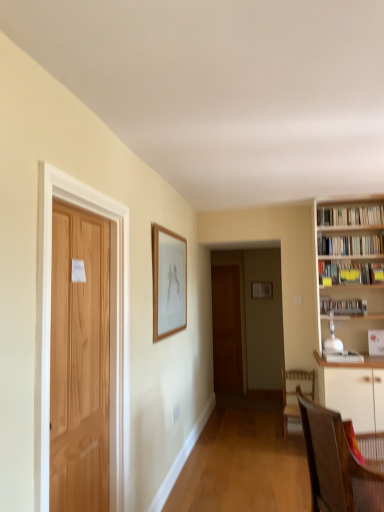
What is the approximate height of wooden picture frame at upper center, the 2th picture frame in the right-to-left sequence?

wooden picture frame at upper center, the 2th picture frame in the right-to-left sequence, is 32.49 inches in height.

You are a GUI agent. You are given a task and a screenshot of the screen. Output one action in this format:
    pyautogui.click(x=<x>, y=<y>)
    Task: Click on the white paper bookshelf at upper right, which is counted as the fourth book, starting from the bottom
    The width and height of the screenshot is (384, 512).
    Given the screenshot: What is the action you would take?
    pyautogui.click(x=350, y=216)

What do you see at coordinates (110, 331) in the screenshot?
I see `natural wood door at left, the first door from the left` at bounding box center [110, 331].

Where is `brown woven chair at lower right, which is the 2th chair in back-to-front order`? The image size is (384, 512). brown woven chair at lower right, which is the 2th chair in back-to-front order is located at coordinates (336, 464).

What are the coordinates of `wooden picture frame at upper center, the first picture frame when ordered from left to right` in the screenshot? It's located at click(x=168, y=282).

Considering the relative sizes of metallic silver bookshelf at right, which is the 1th book from bottom to top, and wooden picture frame at center, positioned as the 2th picture frame in left-to-right order, in the image provided, is metallic silver bookshelf at right, which is the 1th book from bottom to top, shorter than wooden picture frame at center, positioned as the 2th picture frame in left-to-right order,?

Indeed, metallic silver bookshelf at right, which is the 1th book from bottom to top, has a lesser height compared to wooden picture frame at center, positioned as the 2th picture frame in left-to-right order.

Looking at this image, which of these two, metallic silver bookshelf at right, which is the 1th book from bottom to top, or wooden picture frame at center, the first picture frame positioned from the back, is smaller?

Smaller between the two is wooden picture frame at center, the first picture frame positioned from the back.

Is metallic silver bookshelf at right, which is the 1th book from bottom to top, to the right of wooden picture frame at center, the first picture frame positioned from the back, from the viewer's perspective?

→ Yes, metallic silver bookshelf at right, which is the 1th book from bottom to top, is to the right of wooden picture frame at center, the first picture frame positioned from the back.

Is metallic silver bookshelf at right, which is the 1th book from bottom to top, outside of wooden picture frame at center, the first picture frame positioned from the back?

metallic silver bookshelf at right, which is the 1th book from bottom to top, lies outside wooden picture frame at center, the first picture frame positioned from the back,'s area.

Is brown woven chair at lower right, the first chair viewed from the front, inside or outside of natural wood door at left, which is counted as the second door, starting from the back?

brown woven chair at lower right, the first chair viewed from the front, is not enclosed by natural wood door at left, which is counted as the second door, starting from the back.

Between brown woven chair at lower right, which is the 2th chair in back-to-front order, and natural wood door at left, which is counted as the second door, starting from the back, which one appears on the left side from the viewer's perspective?

natural wood door at left, which is counted as the second door, starting from the back, is more to the left.

Which point is more distant from viewer, [335,500] or [120,461]?

The point [120,461] is farther from the camera.

From the picture: Which of these two, brown woven chair at lower right, the first chair viewed from the front, or natural wood door at left, the first door from the left, stands taller?

Standing taller between the two is natural wood door at left, the first door from the left.

How many degrees apart are the facing directions of yellow paper at upper right, the 2th book ordered from the bottom, and wooden picture frame at upper center, the first picture frame when ordered from left to right?

yellow paper at upper right, the 2th book ordered from the bottom, and wooden picture frame at upper center, the first picture frame when ordered from left to right, are facing 89.8 degrees away from each other.

Would you say yellow paper at upper right, the 2th book ordered from the bottom, is outside wooden picture frame at upper center, the 2th picture frame in the right-to-left sequence?

yellow paper at upper right, the 2th book ordered from the bottom, lies outside wooden picture frame at upper center, the 2th picture frame in the right-to-left sequence,'s area.

Is yellow paper at upper right, positioned as the third book in top-to-bottom order, oriented away from wooden picture frame at upper center, the 2th picture frame in the right-to-left sequence?

yellow paper at upper right, positioned as the third book in top-to-bottom order, is not turned away from wooden picture frame at upper center, the 2th picture frame in the right-to-left sequence.

Can you confirm if natural wood door at left, which ranks as the first door in front-to-back order, is bigger than brown wooden chair at lower right, the 1th chair when ordered from back to front?

Yes.

Considering the positions of objects natural wood door at left, the first door from the left, and brown wooden chair at lower right, which is counted as the second chair, starting from the front, in the image provided, who is more to the right, natural wood door at left, the first door from the left, or brown wooden chair at lower right, which is counted as the second chair, starting from the front,?

Positioned to the right is brown wooden chair at lower right, which is counted as the second chair, starting from the front.

Can you confirm if natural wood door at left, marked as the second door in a right-to-left arrangement, is shorter than brown wooden chair at lower right, the 1th chair when ordered from back to front?

No, natural wood door at left, marked as the second door in a right-to-left arrangement, is not shorter than brown wooden chair at lower right, the 1th chair when ordered from back to front.

From a real-world perspective, starting from the brown wooden chair at lower right, which is counted as the second chair, starting from the front, which door is the 2nd one vertically above it? Please provide its 2D coordinates.

[(110, 331)]

Considering the sizes of brown wooden chair at lower right, the 1th chair when ordered from back to front, and wooden picture frame at center, positioned as the 2th picture frame in left-to-right order, in the image, is brown wooden chair at lower right, the 1th chair when ordered from back to front, bigger or smaller than wooden picture frame at center, positioned as the 2th picture frame in left-to-right order,?

brown wooden chair at lower right, the 1th chair when ordered from back to front, is bigger than wooden picture frame at center, positioned as the 2th picture frame in left-to-right order.

Considering the positions of objects brown wooden chair at lower right, which is counted as the second chair, starting from the front, and wooden picture frame at center, which is the first picture frame in right-to-left order, in the image provided, who is more to the right, brown wooden chair at lower right, which is counted as the second chair, starting from the front, or wooden picture frame at center, which is the first picture frame in right-to-left order,?

wooden picture frame at center, which is the first picture frame in right-to-left order.

Is yellow paper at upper right, positioned as the third book in top-to-bottom order, closer to camera compared to wooden picture frame at center, which is the first picture frame in right-to-left order?

Yes, yellow paper at upper right, positioned as the third book in top-to-bottom order, is closer to the viewer.

Which is in front, point (340, 280) or point (272, 284)?

Point (340, 280)

Is yellow paper at upper right, the 2th book ordered from the bottom, with wooden picture frame at center, which is the first picture frame in right-to-left order?

yellow paper at upper right, the 2th book ordered from the bottom, is not next to wooden picture frame at center, which is the first picture frame in right-to-left order, and they're not touching.

Measure the distance between yellow paper at upper right, positioned as the third book in top-to-bottom order, and brown woven chair at lower right, which is the 2th chair in back-to-front order.

yellow paper at upper right, positioned as the third book in top-to-bottom order, and brown woven chair at lower right, which is the 2th chair in back-to-front order, are 6.92 feet apart from each other.

The image size is (384, 512). There is a yellow paper at upper right, the 2th book ordered from the bottom. Identify the location of the 1st chair below it (from the image's perspective). (336, 464).

Is yellow paper at upper right, positioned as the third book in top-to-bottom order, in front of or behind brown woven chair at lower right, the first chair viewed from the front, in the image?

Visually, yellow paper at upper right, positioned as the third book in top-to-bottom order, is located behind brown woven chair at lower right, the first chair viewed from the front.

Does yellow paper at upper right, the 2th book ordered from the bottom, contain brown woven chair at lower right, the first chair viewed from the front?

Definitely not — brown woven chair at lower right, the first chair viewed from the front, is not inside yellow paper at upper right, the 2th book ordered from the bottom.

Which book is the 2nd one when counting from the right side of the wooden picture frame at center, which is the first picture frame in right-to-left order? Please provide its 2D coordinates.

[(343, 306)]

From the image's perspective, count 1st chairs downward from the natural wood door at left, which is counted as the second door, starting from the back, and point to it. Please provide its 2D coordinates.

[(336, 464)]

Estimate the real-world distances between objects in this image. Which object is further from yellow paper at upper right, the 2th book ordered from the bottom, white paper bookshelf at upper right, which is the first book in top-to-bottom order, or wooden door at center, which appears as the first door when viewed from the right?

wooden door at center, which appears as the first door when viewed from the right, is further to yellow paper at upper right, the 2th book ordered from the bottom.

From the image, which object appears to be farther from white glossy bookshelf at right, placed as the 3th book when sorted from bottom to top, metallic silver bookshelf at right, which is counted as the 4th book, starting from the top, or wooden picture frame at upper center, the 1th picture frame when ordered from front to back?

wooden picture frame at upper center, the 1th picture frame when ordered from front to back.

Estimate the real-world distances between objects in this image. Which object is closer to wooden picture frame at upper center, which is the second picture frame from back to front, white paper bookshelf at upper right, which is counted as the fourth book, starting from the bottom, or brown wooden chair at lower right, the 1th chair when ordered from back to front?

brown wooden chair at lower right, the 1th chair when ordered from back to front, is positioned closer to the anchor wooden picture frame at upper center, which is the second picture frame from back to front.

Estimate the real-world distances between objects in this image. Which object is further from wooden door at center, which appears as the first door when viewed from the right, brown woven chair at lower right, the first chair viewed from the front, or white glossy bookshelf at right, placed as the 3th book when sorted from bottom to top?

brown woven chair at lower right, the first chair viewed from the front, is positioned further to the anchor wooden door at center, which appears as the first door when viewed from the right.

When comparing their distances from yellow paper at upper right, positioned as the third book in top-to-bottom order, does brown woven chair at lower right, which is the 2th chair in back-to-front order, or metallic silver bookshelf at right, which is the 1th book from bottom to top, seem further?

The object further to yellow paper at upper right, positioned as the third book in top-to-bottom order, is brown woven chair at lower right, which is the 2th chair in back-to-front order.

Looking at the image, which one is located further to brown woven chair at lower right, the first chair viewed from the front, wooden picture frame at center, the first picture frame positioned from the back, or natural wood door at left, the first door from the left?

wooden picture frame at center, the first picture frame positioned from the back, lies further to brown woven chair at lower right, the first chair viewed from the front, than the other object.

Based on their spatial positions, is brown wooden chair at lower right, which is counted as the second chair, starting from the front, or white glossy bookshelf at right, which ranks as the second book in top-to-bottom order, further from white paper bookshelf at upper right, which is counted as the fourth book, starting from the bottom?

brown wooden chair at lower right, which is counted as the second chair, starting from the front.

Based on their spatial positions, is yellow paper at upper right, the 2th book ordered from the bottom, or metallic silver bookshelf at right, which is counted as the 4th book, starting from the top, further from wooden picture frame at upper center, the 1th picture frame when ordered from front to back?

Based on the image, yellow paper at upper right, the 2th book ordered from the bottom, appears to be further to wooden picture frame at upper center, the 1th picture frame when ordered from front to back.

I want to click on picture frame between natural wood door at left, marked as the second door in a right-to-left arrangement, and brown wooden chair at lower right, which is counted as the second chair, starting from the front, from front to back, so click(168, 282).

Identify the location of picture frame between metallic silver bookshelf at right, which is the 1th book from bottom to top, and wooden door at center, which appears as the first door when viewed from the right, along the z-axis. point(262,290).

Identify the location of chair positioned between brown woven chair at lower right, the first chair viewed from the front, and white paper bookshelf at upper right, which is counted as the fourth book, starting from the bottom, from near to far. (294, 393).

The height and width of the screenshot is (512, 384). I want to click on book between wooden picture frame at upper center, the 1th picture frame when ordered from front to back, and metallic silver bookshelf at right, which is counted as the 4th book, starting from the top, in the horizontal direction, so click(350, 216).